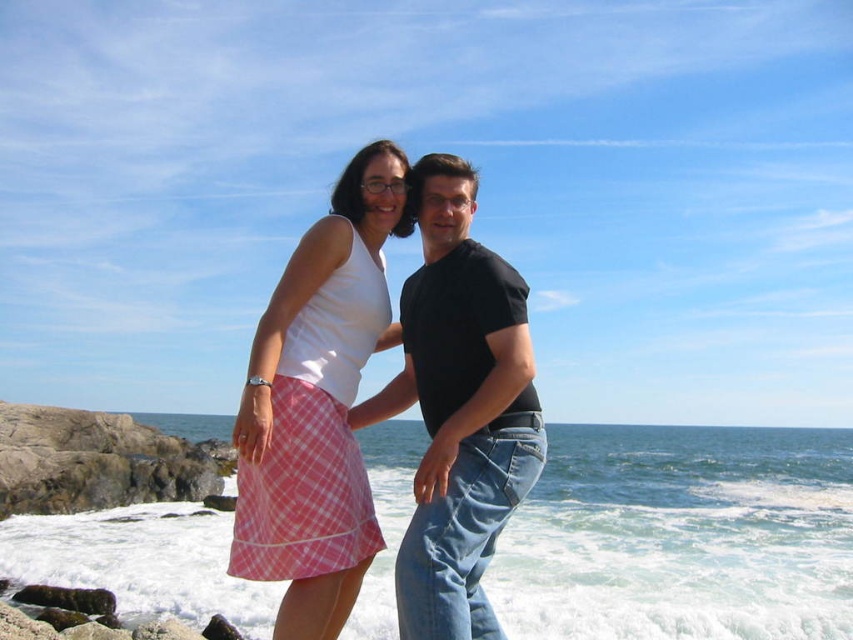
Who is shorter, pink checkered skirt at center or black cotton t-shirt at center?

pink checkered skirt at center is shorter.

Based on the photo, who is more distant from viewer, (364, 358) or (486, 458)?

The point (364, 358) is more distant.

Does point (320, 609) lie in front of point (428, 566)?

No, (320, 609) is further to viewer.

Identify the location of pink checkered skirt at center. pos(317,404).